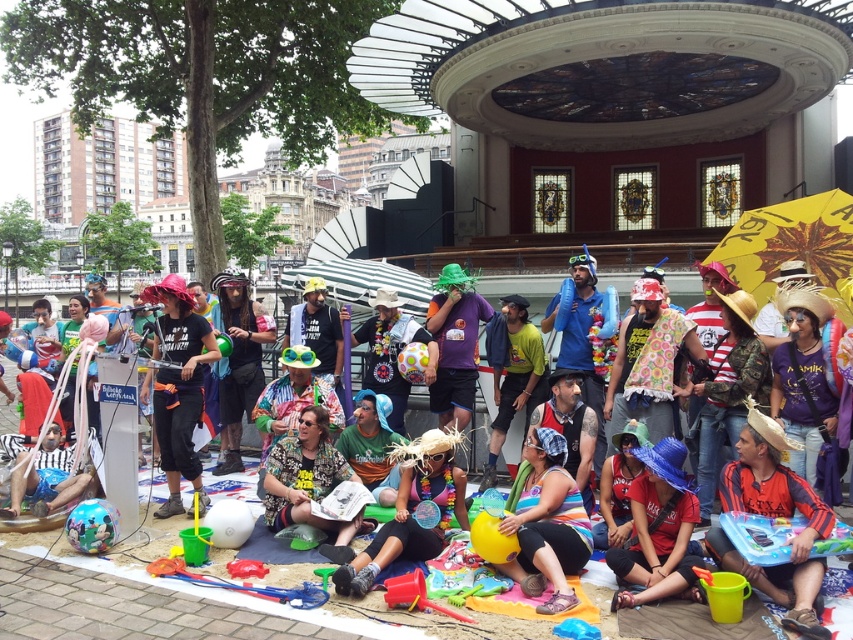
Question: Can you confirm if striped fabric shirt at lower right is smaller than glossy plastic ball at lower left?

Choices:
 (A) yes
 (B) no

Answer: (A)

Question: Is matte red shirt at center thinner than red plastic shovel at lower center?

Choices:
 (A) no
 (B) yes

Answer: (A)

Question: Is matte black shirt at center above rainbow fabric dress at center?

Choices:
 (A) yes
 (B) no

Answer: (A)

Question: Estimate the real-world distances between objects in this image. Which object is farther from the rainbow fabric dress at center?

Choices:
 (A) red plastic shovel at lower center
 (B) matte red shirt at center
 (C) striped fabric person at lower left
 (D) printed fabric person at center

Answer: (C)

Question: Estimate the real-world distances between objects in this image. Which object is closer to the red plastic shovel at lower center?

Choices:
 (A) matte black shirt at center
 (B) multicolored fabric headscarf at center
 (C) multicolored fabric hat at center

Answer: (C)

Question: Considering the real-world distances, which object is closest to the matte black shirt at center?

Choices:
 (A) multicolored fabric hat at center
 (B) striped fabric person at lower left
 (C) rainbow fabric dress at center

Answer: (B)